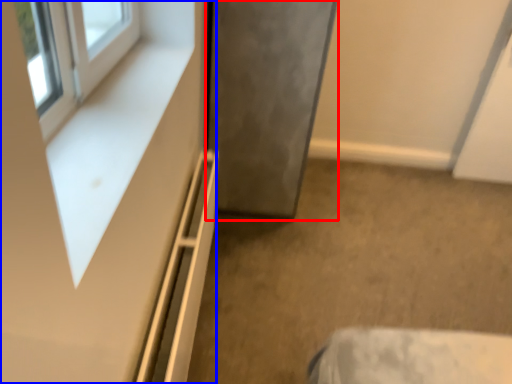
Question: Which of the following is the farthest to the observer, door (highlighted by a red box) or dresser (highlighted by a blue box)?

Choices:
 (A) door
 (B) dresser

Answer: (A)